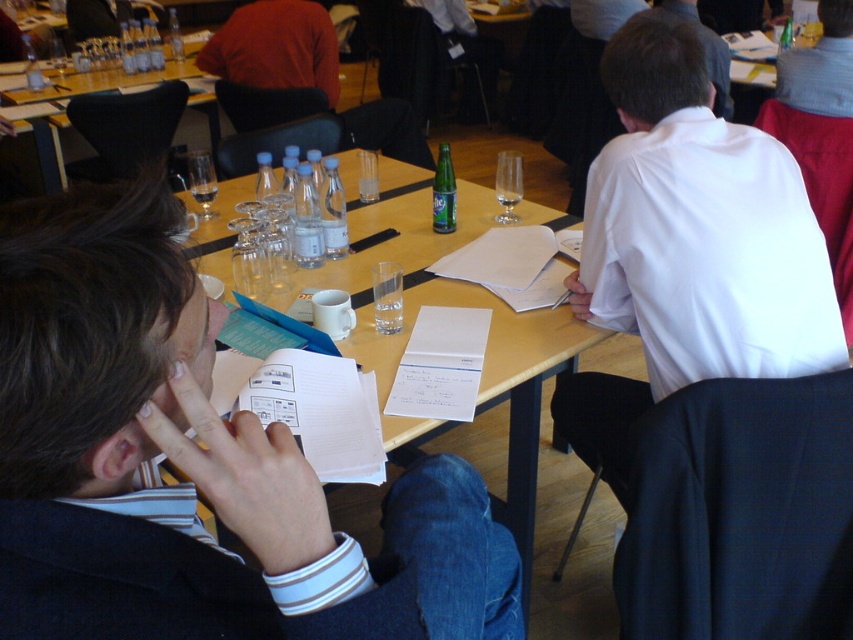
Question: Is wooden table at center below light blue shirt at upper right?

Choices:
 (A) no
 (B) yes

Answer: (B)

Question: Based on their relative distances, which object is nearer to the white smooth shirt at upper right?

Choices:
 (A) white shirt at upper right
 (B) transparent glass wine glass at upper center
 (C) light blue shirt at upper right
 (D) clear glass bottle at upper right

Answer: (B)

Question: Estimate the real-world distances between objects in this image. Which object is closer to the white shirt at upper right?

Choices:
 (A) light blue shirt at upper right
 (B) white paper at center
 (C) transparent glass at table center

Answer: (A)

Question: Is wooden table at center further to the viewer compared to light blue shirt at upper right?

Choices:
 (A) no
 (B) yes

Answer: (A)

Question: Is white smooth shirt at upper right further to the viewer compared to matte orange shirt at upper center?

Choices:
 (A) no
 (B) yes

Answer: (A)

Question: Which point is closer to the camera?

Choices:
 (A) white smooth shirt at upper right
 (B) white paper at center

Answer: (B)